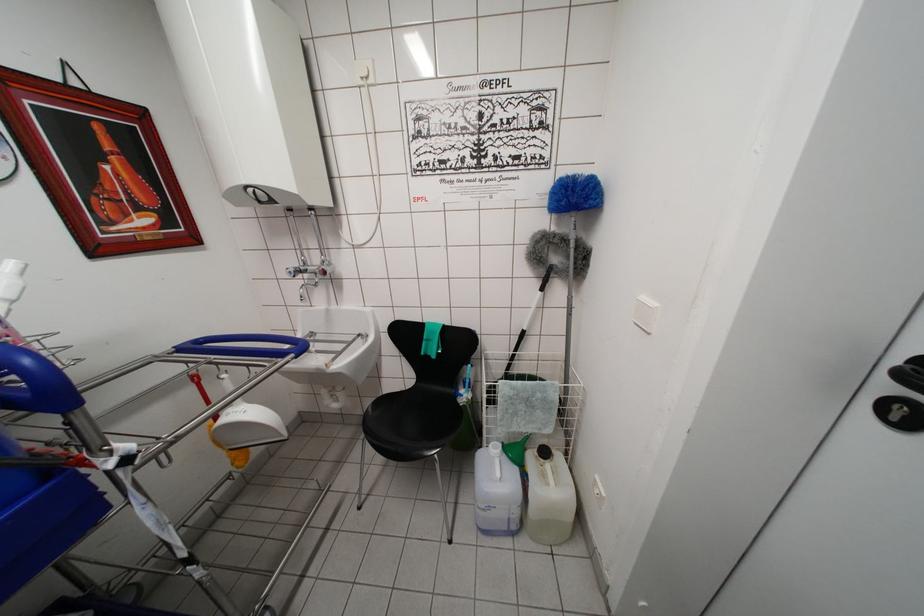
The location [568,325] corresponds to which object?

It corresponds to the grey duster in the image.